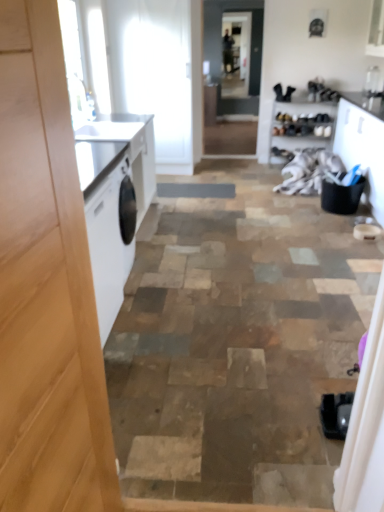
How much space does clear glass screen door at center, which ranks as the 2th screen door in bottom-to-top order, occupy horizontally?

1.39 inches.

The image size is (384, 512). In order to click on white fabric at center in this screenshot , I will do `click(308, 170)`.

The height and width of the screenshot is (512, 384). I want to click on clear glass screen door at center, the 1th screen door viewed from the back, so click(x=236, y=54).

From a real-world perspective, is white fabric at center located beneath clear glass screen door at center, acting as the 2th screen door starting from the top?

Yes, from a real-world perspective, white fabric at center is below clear glass screen door at center, acting as the 2th screen door starting from the top.

From the image's perspective, who appears lower, white fabric at center or clear glass screen door at center, which ranks as the first screen door in front-to-back order?

white fabric at center is shown below in the image.

Is white fabric at center looking in the opposite direction of clear glass screen door at center, which is the first screen door in bottom-to-top order?

No, clear glass screen door at center, which is the first screen door in bottom-to-top order, is not at the back of white fabric at center.

From the image's perspective, is clear glass screen door at center, which is the 2th screen door from front to back, above white fabric at center?

Yes, from the image's perspective, clear glass screen door at center, which is the 2th screen door from front to back, is over white fabric at center.

Does clear glass screen door at center, which ranks as the 2th screen door in bottom-to-top order, contain white fabric at center?

No.

How many degrees apart are the facing directions of clear glass screen door at center, which is the 2th screen door from front to back, and white fabric at center?

There is a 90.2-degree angle between the facing directions of clear glass screen door at center, which is the 2th screen door from front to back, and white fabric at center.

Which object is wider, clear glass screen door at center, the 1th screen door viewed from the back, or white fabric at center?

white fabric at center.

Can you tell me how much clear glass screen door at center, arranged as the 1th screen door when viewed from the top, and wooden shoe rack at upper right differ in facing direction?

There is a 0.127-degree angle between the facing directions of clear glass screen door at center, arranged as the 1th screen door when viewed from the top, and wooden shoe rack at upper right.

From the image's perspective, is clear glass screen door at center, which is the 2th screen door from front to back, below wooden shoe rack at upper right?

No, from the image's perspective, clear glass screen door at center, which is the 2th screen door from front to back, is not below wooden shoe rack at upper right.

Could you tell me if clear glass screen door at center, arranged as the 1th screen door when viewed from the top, is facing wooden shoe rack at upper right?

Yes.

Looking at this image, which is more to the right, clear glass screen door at center, arranged as the 1th screen door when viewed from the top, or wooden shoe rack at upper right?

wooden shoe rack at upper right.

From the image's perspective, is clear glass screen door at center, which is the first screen door in bottom-to-top order, above or below white fabric at center?

clear glass screen door at center, which is the first screen door in bottom-to-top order, is situated higher than white fabric at center in the image.

Is clear glass screen door at center, acting as the 2th screen door starting from the top, bigger than white fabric at center?

Actually, clear glass screen door at center, acting as the 2th screen door starting from the top, might be smaller than white fabric at center.

Does clear glass screen door at center, which ranks as the first screen door in front-to-back order, lie behind white fabric at center?

Yes.

Is clear glass screen door at center, acting as the 2th screen door starting from the top, aimed at white fabric at center?

No, clear glass screen door at center, acting as the 2th screen door starting from the top, is not turned towards white fabric at center.

Considering the relative sizes of clear glass screen door at center, which ranks as the 2th screen door in bottom-to-top order, and clear glass screen door at center, which ranks as the first screen door in front-to-back order, in the image provided, is clear glass screen door at center, which ranks as the 2th screen door in bottom-to-top order, wider than clear glass screen door at center, which ranks as the first screen door in front-to-back order,?

In fact, clear glass screen door at center, which ranks as the 2th screen door in bottom-to-top order, might be narrower than clear glass screen door at center, which ranks as the first screen door in front-to-back order.

What's the angular difference between clear glass screen door at center, arranged as the 1th screen door when viewed from the top, and clear glass screen door at center, arranged as the second screen door when viewed from the back,'s facing directions?

clear glass screen door at center, arranged as the 1th screen door when viewed from the top, and clear glass screen door at center, arranged as the second screen door when viewed from the back, are facing 0.834 degrees away from each other.

Does point (237, 20) come in front of point (257, 55)?

Yes, point (237, 20) is closer to viewer.

Is clear glass screen door at center, which ranks as the first screen door in front-to-back order, at the back of clear glass screen door at center, arranged as the 1th screen door when viewed from the top?

No.

Which object is thinner, white fabric at center or wooden shoe rack at upper right?

With smaller width is wooden shoe rack at upper right.

Is white fabric at center spatially inside wooden shoe rack at upper right, or outside of it?

white fabric at center is located beyond the bounds of wooden shoe rack at upper right.

Which is in front, point (300, 152) or point (302, 115)?

The point (300, 152) is more forward.

Between point (291, 137) and point (303, 156), which one is positioned in front?

The point (303, 156) is in front.

Looking at this image, is wooden shoe rack at upper right taller than white fabric at center?

Indeed, wooden shoe rack at upper right has a greater height compared to white fabric at center.

Is wooden shoe rack at upper right positioned with its back to white fabric at center?

No, wooden shoe rack at upper right's orientation is not away from white fabric at center.

From the image's perspective, does wooden shoe rack at upper right appear higher than white fabric at center?

Correct, wooden shoe rack at upper right appears higher than white fabric at center in the image.

What are the coordinates of `laundry in front of the clear glass screen door at center, which is the first screen door in bottom-to-top order` in the screenshot? It's located at (308, 170).

Locate an element on the screen. screen door that is the 2nd object located behind the white fabric at center is located at coordinates (236, 54).

Estimate the real-world distances between objects in this image. Which object is further from clear glass screen door at center, arranged as the 1th screen door when viewed from the top, wooden shoe rack at upper right or white fabric at center?

white fabric at center is positioned further to the anchor clear glass screen door at center, arranged as the 1th screen door when viewed from the top.

Looking at the image, which one is located closer to clear glass screen door at center, which ranks as the first screen door in front-to-back order, white fabric at center or wooden shoe rack at upper right?

Among the two, wooden shoe rack at upper right is located nearer to clear glass screen door at center, which ranks as the first screen door in front-to-back order.

Looking at the image, which one is located closer to clear glass screen door at center, arranged as the 1th screen door when viewed from the top, white fabric at center or clear glass screen door at center, acting as the 2th screen door starting from the top?

clear glass screen door at center, acting as the 2th screen door starting from the top, lies closer to clear glass screen door at center, arranged as the 1th screen door when viewed from the top, than the other object.

Looking at the image, which one is located closer to white fabric at center, clear glass screen door at center, which is the 2th screen door from front to back, or wooden shoe rack at upper right?

wooden shoe rack at upper right is closer to white fabric at center.

In the scene shown: Which object lies nearer to the anchor point wooden shoe rack at upper right, white fabric at center or clear glass screen door at center, which ranks as the 2th screen door in bottom-to-top order?

white fabric at center is closer to wooden shoe rack at upper right.

Estimate the real-world distances between objects in this image. Which object is closer to white fabric at center, wooden shoe rack at upper right or clear glass screen door at center, which is the first screen door in bottom-to-top order?

The object closer to white fabric at center is wooden shoe rack at upper right.

Which object lies further to the anchor point clear glass screen door at center, which ranks as the first screen door in front-to-back order, wooden shoe rack at upper right or white fabric at center?

Among the two, white fabric at center is located further to clear glass screen door at center, which ranks as the first screen door in front-to-back order.

Considering their positions, is clear glass screen door at center, which ranks as the first screen door in front-to-back order, positioned further to wooden shoe rack at upper right than white fabric at center?

clear glass screen door at center, which ranks as the first screen door in front-to-back order, lies further to wooden shoe rack at upper right than the other object.

Where is `cabinetry between white fabric at center and clear glass screen door at center, arranged as the 1th screen door when viewed from the top, from front to back`? cabinetry between white fabric at center and clear glass screen door at center, arranged as the 1th screen door when viewed from the top, from front to back is located at coordinates (302, 123).

Locate an element on the screen. screen door between white fabric at center and clear glass screen door at center, which is the 2th screen door from front to back, along the z-axis is located at coordinates (221, 51).

Where is `cabinetry between clear glass screen door at center, arranged as the second screen door when viewed from the back, and white fabric at center from top to bottom`? The width and height of the screenshot is (384, 512). cabinetry between clear glass screen door at center, arranged as the second screen door when viewed from the back, and white fabric at center from top to bottom is located at coordinates click(x=302, y=123).

The width and height of the screenshot is (384, 512). In order to click on screen door between wooden shoe rack at upper right and clear glass screen door at center, arranged as the 1th screen door when viewed from the top, along the z-axis in this screenshot , I will do `click(221, 51)`.